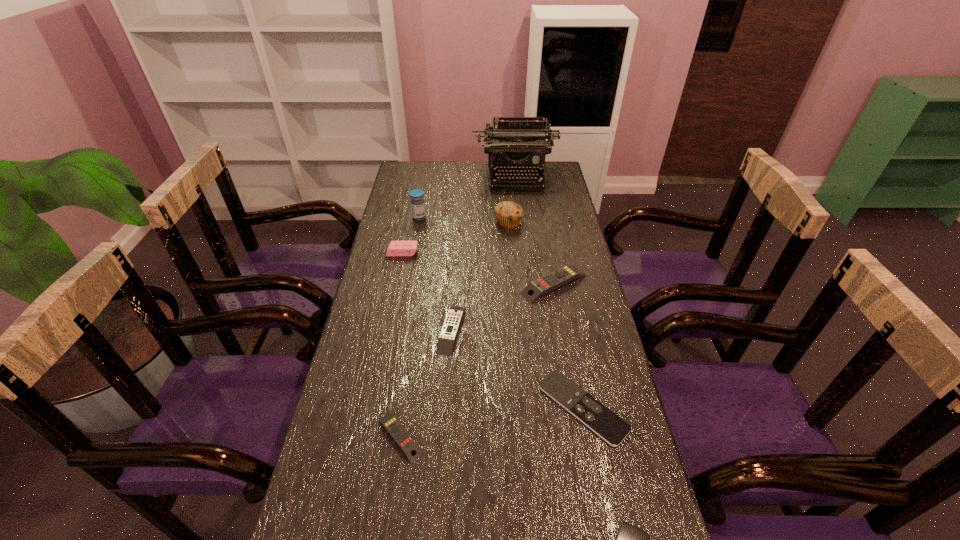
The height and width of the screenshot is (540, 960). Identify the location of typewriter. (515, 144).

Where is `the farthest object`? the farthest object is located at coordinates pyautogui.click(x=515, y=144).

Find the location of a particular element. the second tallest object is located at coordinates (417, 201).

Identify the location of medicine. (417, 201).

What are the coordinates of `muffin` in the screenshot? It's located at (508, 214).

Identify the location of the sixth nearest object. This screenshot has height=540, width=960. (395, 248).

This screenshot has height=540, width=960. In order to click on pink eraser in this screenshot , I will do [x=395, y=248].

Identify the location of the fifth nearest object. This screenshot has width=960, height=540. [534, 290].

Image resolution: width=960 pixels, height=540 pixels. Find the location of `the farthest remote control`. the farthest remote control is located at coordinates (534, 290).

You are a GUI agent. You are given a task and a screenshot of the screen. Output one action in this format:
    pyautogui.click(x=<x>, y=<y>)
    Task: Click on the fourth remote control from right to left
    
    Given the screenshot: What is the action you would take?
    pyautogui.click(x=450, y=328)